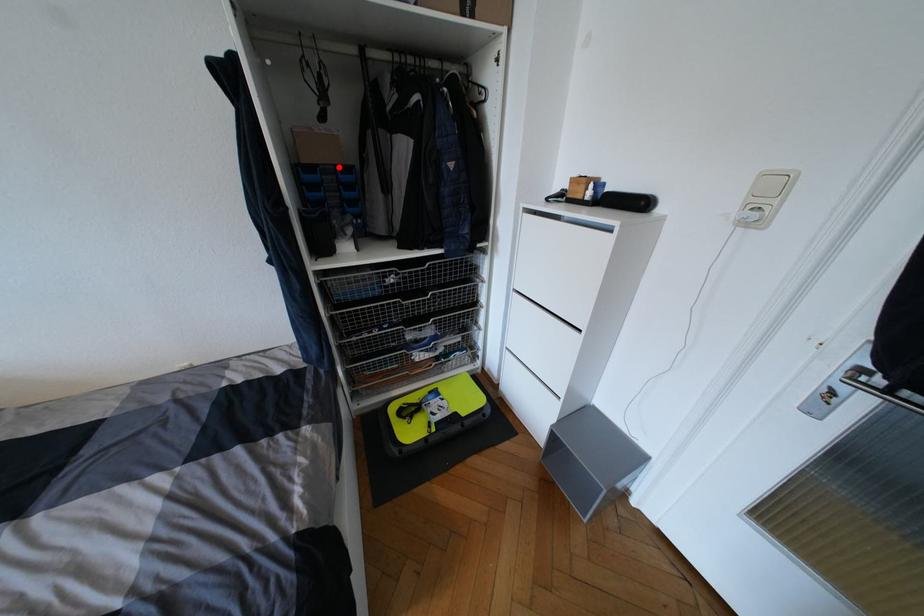
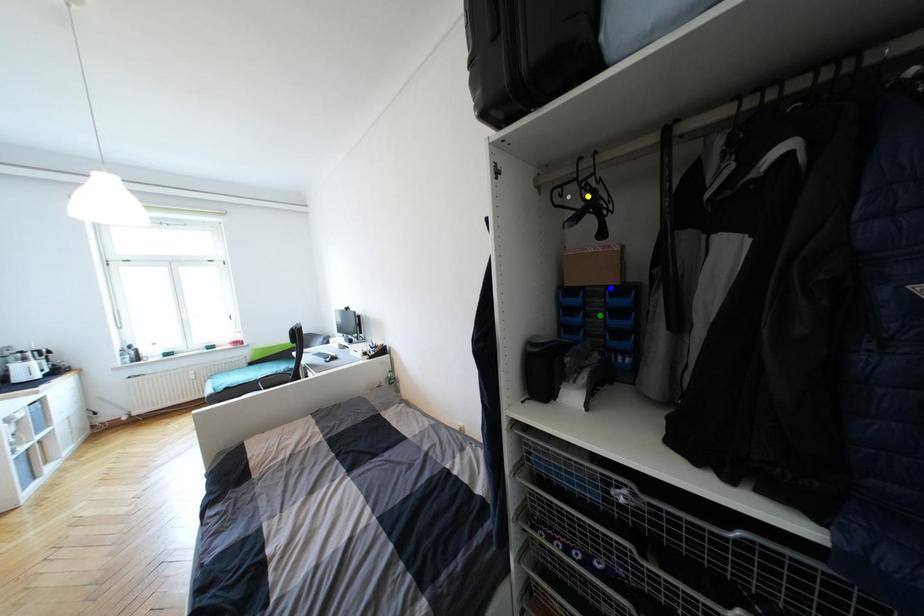
Question: I am providing you with two images of the same scene from different viewpoints. A red point is marked on the first image. You are given multiple points on the second image. In image 2, which mark is for the same physical point as the one in image 1?

Choices:
 (A) blue point
 (B) green point
 (C) yellow point

Answer: (A)